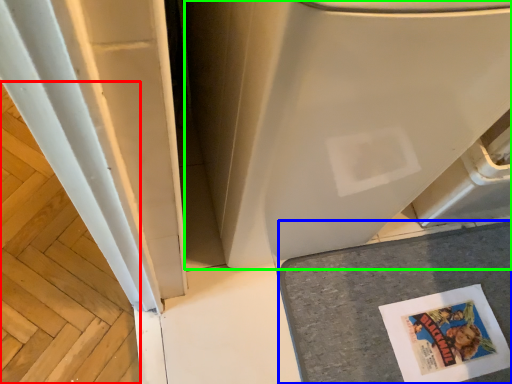
Question: Based on their relative distances, which object is farther from wood (highlighted by a red box)? Choose from counter top (highlighted by a blue box) and water heater (highlighted by a green box).

Choices:
 (A) counter top
 (B) water heater

Answer: (A)